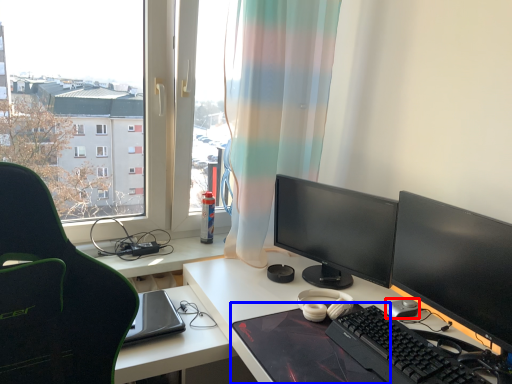
Question: Which object appears farthest to the camera in this image, mouse (highlighted by a red box) or mousepad (highlighted by a blue box)?

Choices:
 (A) mouse
 (B) mousepad

Answer: (A)